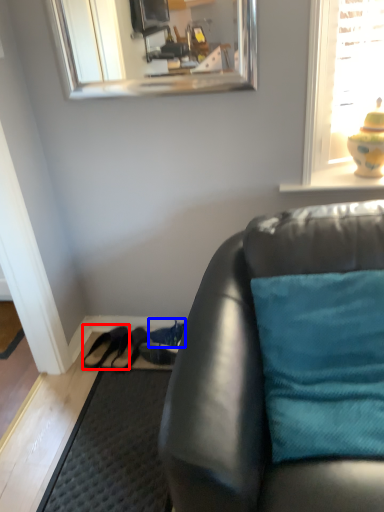
Question: Which point is further to the camera, shoe (highlighted by a red box) or shoe (highlighted by a blue box)?

Choices:
 (A) shoe
 (B) shoe

Answer: (B)